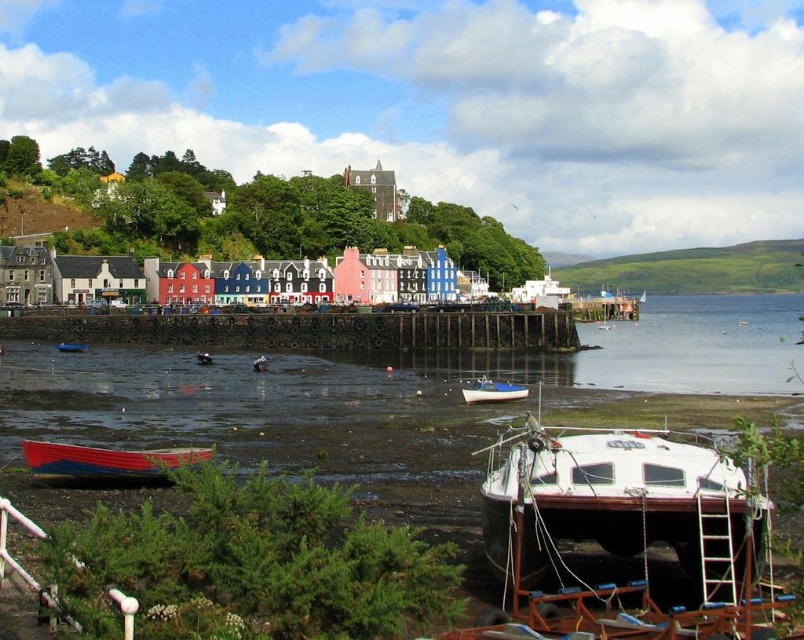
Question: Estimate the real-world distances between objects in this image. Which object is closer to the blue glossy boat at lower left?

Choices:
 (A) black concrete dock at center
 (B) white matte boat at center

Answer: (A)

Question: Is white matte boat at lower right to the right of red wood boat at lower left from the viewer's perspective?

Choices:
 (A) no
 (B) yes

Answer: (B)

Question: Does white matte boat at center lie in front of wooden rowboat at lower left?

Choices:
 (A) yes
 (B) no

Answer: (A)

Question: Considering the real-world distances, which object is closest to the white matte boat at center?

Choices:
 (A) white matte boat at lower right
 (B) red wood boat at lower left
 (C) wooden rowboat at lower left
 (D) black concrete dock at center

Answer: (D)

Question: Which point is closer to the camera?

Choices:
 (A) (753, 561)
 (B) (208, 362)
 (C) (19, 314)
 (D) (46, 476)

Answer: (A)

Question: Does black concrete dock at center appear under red wood boat at lower left?

Choices:
 (A) no
 (B) yes

Answer: (A)